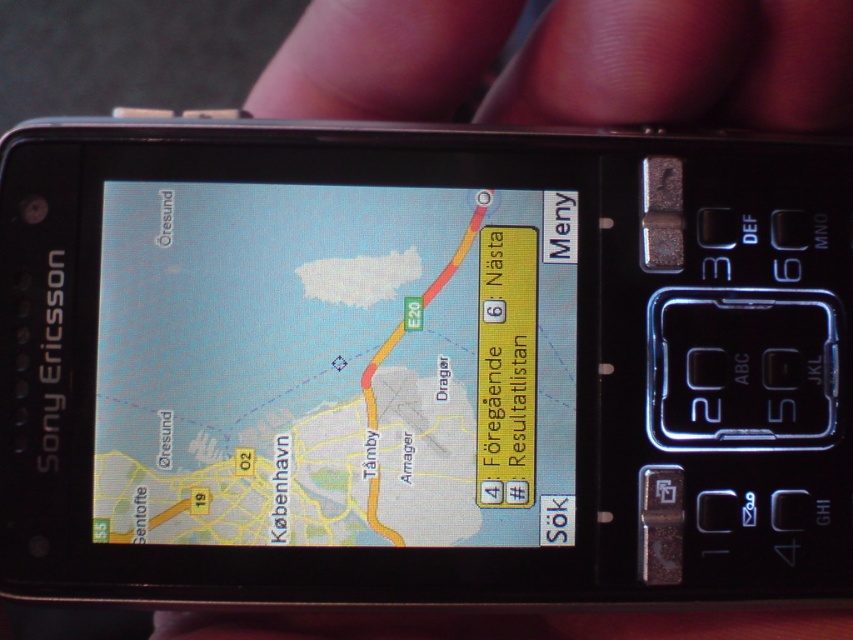
You are holding a Sony Ericsson phone with the matte plastic navigation screen at center. You want to check the map details on the screen. Given that your eyes are 25 inches away from the screen, can you comfortably view the map without moving the phone?

The matte plastic navigation screen at center is 29.53 inches away from viewer. Since your eyes are 25 inches away, you are closer than the screen distance, so you would need to move back to 29.53 inches to view comfortably.

You are holding a Sony Ericsson phone and looking at its screen. You see the matte plastic navigation screen at center and the pink flesh at upper center. Which object is positioned to the right?

The pink flesh at upper center is positioned to the right of the matte plastic navigation screen at center.

You are holding the Sony Ericsson phone and want to check the navigation screen. Which object is larger in size between the matte plastic navigation screen at center and the pink flesh at upper center?

The pink flesh at upper center is larger than the matte plastic navigation screen at center.